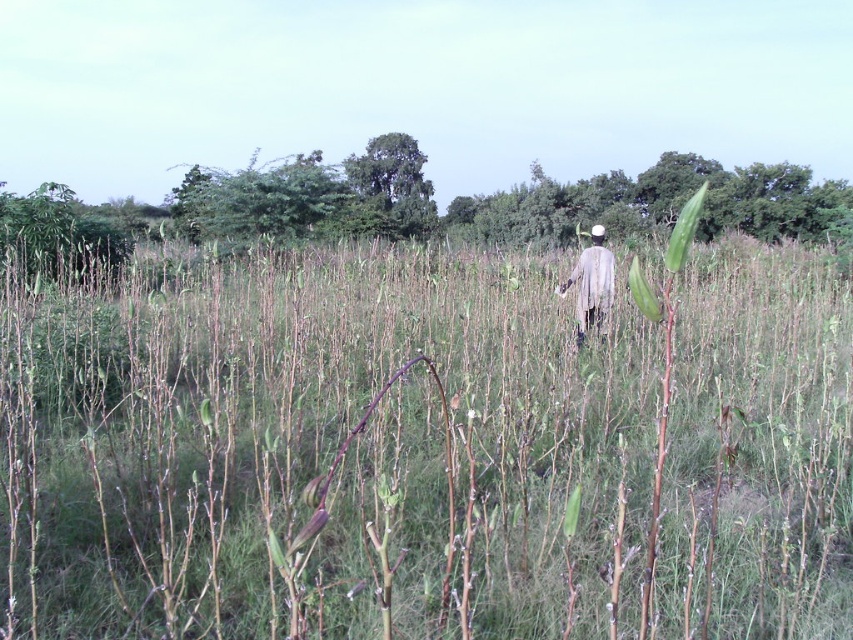
Is green matte grass at center above light gray fabric at center?

Incorrect, green matte grass at center is not positioned above light gray fabric at center.

Is green matte grass at center positioned before light gray fabric at center?

Yes.

Does point (149, 500) come in front of point (581, 275)?

Yes, point (149, 500) is closer to viewer.

At what (x,y) coordinates should I click in order to perform the action: click on green matte grass at center. Please return your answer as a coordinate pair (x, y). Looking at the image, I should click on (422, 451).